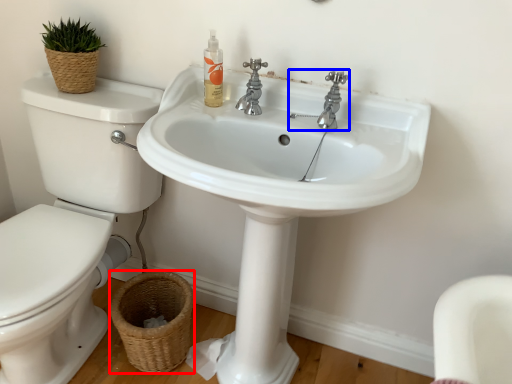
Question: Among these objects, which one is farthest to the camera, basket (highlighted by a red box) or tap (highlighted by a blue box)?

Choices:
 (A) basket
 (B) tap

Answer: (A)